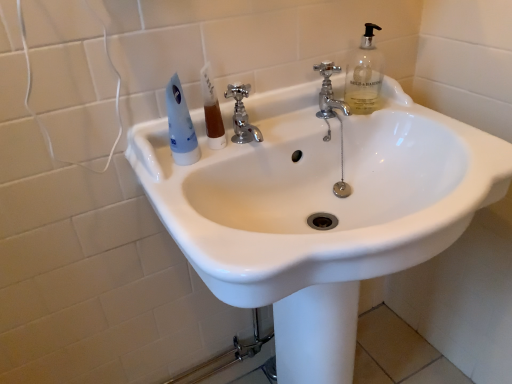
Measure the distance between brown translucent liquid at center and camera.

The distance of brown translucent liquid at center from camera is 75.55 centimeters.

Measure the distance between point (214,112) and camera.

Point (214,112) and camera are 76.20 centimeters apart from each other.

The image size is (512, 384). In order to click on white glossy sink at center in this screenshot , I will do `click(319, 210)`.

Is white glossy sink at center further to camera compared to blue plastic toothpaste at upper left?

No, the depth of white glossy sink at center is less than that of blue plastic toothpaste at upper left.

How much distance is there between white glossy sink at center and blue plastic toothpaste at upper left?

The distance of white glossy sink at center from blue plastic toothpaste at upper left is 11.80 inches.

Which object is positioned more to the right, white glossy sink at center or blue plastic toothpaste at upper left?

From the viewer's perspective, white glossy sink at center appears more on the right side.

From the image's perspective, does white glossy sink at center appear lower than blue plastic toothpaste at upper left?

Yes, from the image's perspective, white glossy sink at center is beneath blue plastic toothpaste at upper left.

How different are the orientations of polished chrome faucet at upper center, positioned as the 2th tap in left-to-right order, and chrome metallic faucet at center, which is counted as the 1th tap, starting from the left, in degrees?

The angle between the facing direction of polished chrome faucet at upper center, positioned as the 2th tap in left-to-right order, and the facing direction of chrome metallic faucet at center, which is counted as the 1th tap, starting from the left, is 0.00179 degrees.

Is polished chrome faucet at upper center, positioned as the 2th tap in left-to-right order, not within chrome metallic faucet at center, which is counted as the 1th tap, starting from the left?

Absolutely, polished chrome faucet at upper center, positioned as the 2th tap in left-to-right order, is external to chrome metallic faucet at center, which is counted as the 1th tap, starting from the left.

Which point is more forward, (327, 73) or (250, 139)?

The point (250, 139) is closer.

Which object is positioned more to the left, polished chrome faucet at upper center, positioned as the 2th tap in left-to-right order, or chrome metallic faucet at center, positioned as the second tap in right-to-left order?

Positioned to the left is chrome metallic faucet at center, positioned as the second tap in right-to-left order.

How many degrees apart are the facing directions of polished chrome faucet at upper center, positioned as the 1th tap in right-to-left order, and blue plastic toothpaste at upper left?

polished chrome faucet at upper center, positioned as the 1th tap in right-to-left order, and blue plastic toothpaste at upper left are facing 7.39 degrees away from each other.

Is polished chrome faucet at upper center, positioned as the 1th tap in right-to-left order, wider than blue plastic toothpaste at upper left?

No.

Between polished chrome faucet at upper center, positioned as the 2th tap in left-to-right order, and blue plastic toothpaste at upper left, which one appears on the right side from the viewer's perspective?

From the viewer's perspective, polished chrome faucet at upper center, positioned as the 2th tap in left-to-right order, appears more on the right side.

Does polished chrome faucet at upper center, positioned as the 1th tap in right-to-left order, have a larger size compared to blue plastic toothpaste at upper left?

No.

Is blue plastic toothpaste at upper left touching white glossy sink at center?

They are not placed beside each other.

Can you tell me how much blue plastic toothpaste at upper left and white glossy sink at center differ in facing direction?

The angular difference between blue plastic toothpaste at upper left and white glossy sink at center is 0.00265 degrees.

Which is more to the left, blue plastic toothpaste at upper left or white glossy sink at center?

blue plastic toothpaste at upper left.

From a real-world perspective, is blue plastic toothpaste at upper left over white glossy sink at center?

Yes, from a real-world perspective, blue plastic toothpaste at upper left is over white glossy sink at center

From the image's perspective, is white glossy sink at center below polished chrome faucet at upper center, positioned as the 2th tap in left-to-right order?

Yes, from the image's perspective, white glossy sink at center is below polished chrome faucet at upper center, positioned as the 2th tap in left-to-right order.

From a real-world perspective, between white glossy sink at center and polished chrome faucet at upper center, positioned as the 2th tap in left-to-right order, who is vertically lower?

white glossy sink at center is physically lower.

Does point (234, 86) appear closer or farther from the camera than point (420, 170)?

Point (234, 86) is closer to the camera than point (420, 170).

Is chrome metallic faucet at center, which is counted as the 1th tap, starting from the left, not near white glossy sink at center?

They are positioned close to each other.

Can you tell me how much chrome metallic faucet at center, positioned as the second tap in right-to-left order, and white glossy sink at center differ in facing direction?

chrome metallic faucet at center, positioned as the second tap in right-to-left order, and white glossy sink at center are facing 7.39 degrees away from each other.

From the image's perspective, is chrome metallic faucet at center, positioned as the second tap in right-to-left order, on brown translucent liquid at center?

Correct, chrome metallic faucet at center, positioned as the second tap in right-to-left order, appears higher than brown translucent liquid at center in the image.

From a real-world perspective, who is located higher, chrome metallic faucet at center, which is counted as the 1th tap, starting from the left, or brown translucent liquid at center?

In real-world perspective, chrome metallic faucet at center, which is counted as the 1th tap, starting from the left, is above.

Considering the sizes of objects chrome metallic faucet at center, positioned as the second tap in right-to-left order, and brown translucent liquid at center in the image provided, who is thinner, chrome metallic faucet at center, positioned as the second tap in right-to-left order, or brown translucent liquid at center?

Thinner between the two is brown translucent liquid at center.

Locate an element on the screen. This screenshot has width=512, height=384. mouthwash that is on the left side of white glossy sink at center is located at coordinates (180, 125).

The width and height of the screenshot is (512, 384). Find the location of `tap behind the chrome metallic faucet at center, which is counted as the 1th tap, starting from the left`. tap behind the chrome metallic faucet at center, which is counted as the 1th tap, starting from the left is located at coordinates (329, 92).

Based on their spatial positions, is blue plastic toothpaste at upper left or brown translucent liquid at center further from chrome metallic faucet at center, positioned as the second tap in right-to-left order?

blue plastic toothpaste at upper left lies further to chrome metallic faucet at center, positioned as the second tap in right-to-left order, than the other object.

Based on their spatial positions, is chrome metallic faucet at center, positioned as the second tap in right-to-left order, or blue plastic toothpaste at upper left closer to brown translucent liquid at center?

chrome metallic faucet at center, positioned as the second tap in right-to-left order, is closer to brown translucent liquid at center.

Considering their positions, is chrome metallic faucet at center, which is counted as the 1th tap, starting from the left, positioned further to blue plastic toothpaste at upper left than polished chrome faucet at upper center, positioned as the 1th tap in right-to-left order?

polished chrome faucet at upper center, positioned as the 1th tap in right-to-left order, lies further to blue plastic toothpaste at upper left than the other object.

Based on their spatial positions, is blue plastic toothpaste at upper left or polished chrome faucet at upper center, positioned as the 1th tap in right-to-left order, closer to chrome metallic faucet at center, positioned as the second tap in right-to-left order?

Based on the image, blue plastic toothpaste at upper left appears to be nearer to chrome metallic faucet at center, positioned as the second tap in right-to-left order.

Considering their positions, is polished chrome faucet at upper center, positioned as the 2th tap in left-to-right order, positioned closer to blue plastic toothpaste at upper left than white glossy sink at center?

white glossy sink at center is closer to blue plastic toothpaste at upper left.

Considering their positions, is chrome metallic faucet at center, positioned as the second tap in right-to-left order, positioned further to polished chrome faucet at upper center, positioned as the 1th tap in right-to-left order, than white glossy sink at center?

The object further to polished chrome faucet at upper center, positioned as the 1th tap in right-to-left order, is white glossy sink at center.

Looking at the image, which one is located closer to brown translucent liquid at center, polished chrome faucet at upper center, positioned as the 2th tap in left-to-right order, or white glossy sink at center?

Among the two, polished chrome faucet at upper center, positioned as the 2th tap in left-to-right order, is located nearer to brown translucent liquid at center.

Based on their spatial positions, is brown translucent liquid at center or chrome metallic faucet at center, which is counted as the 1th tap, starting from the left, closer to blue plastic toothpaste at upper left?

brown translucent liquid at center is closer to blue plastic toothpaste at upper left.

In order to click on liquid between chrome metallic faucet at center, which is counted as the 1th tap, starting from the left, and white glossy sink at center, in the vertical direction in this screenshot , I will do `click(214, 126)`.

This screenshot has height=384, width=512. In order to click on liquid situated between blue plastic toothpaste at upper left and chrome metallic faucet at center, which is counted as the 1th tap, starting from the left, from left to right in this screenshot , I will do `click(214, 126)`.

What are the coordinates of `tap situated between brown translucent liquid at center and polished chrome faucet at upper center, positioned as the 2th tap in left-to-right order, from left to right` in the screenshot? It's located at (242, 115).

Find the location of a particular element. This screenshot has height=384, width=512. tap located between blue plastic toothpaste at upper left and polished chrome faucet at upper center, positioned as the 1th tap in right-to-left order, in the left-right direction is located at coordinates (242, 115).